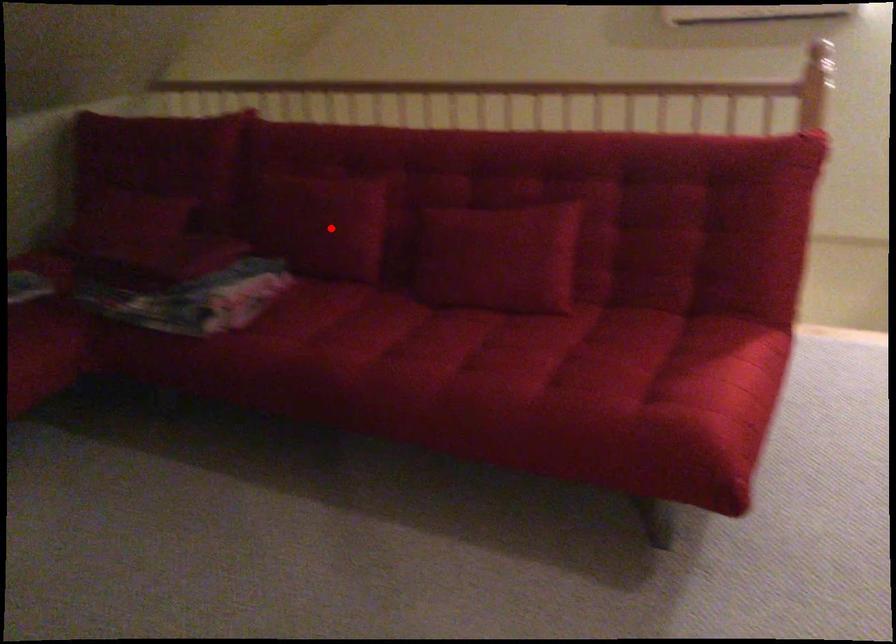
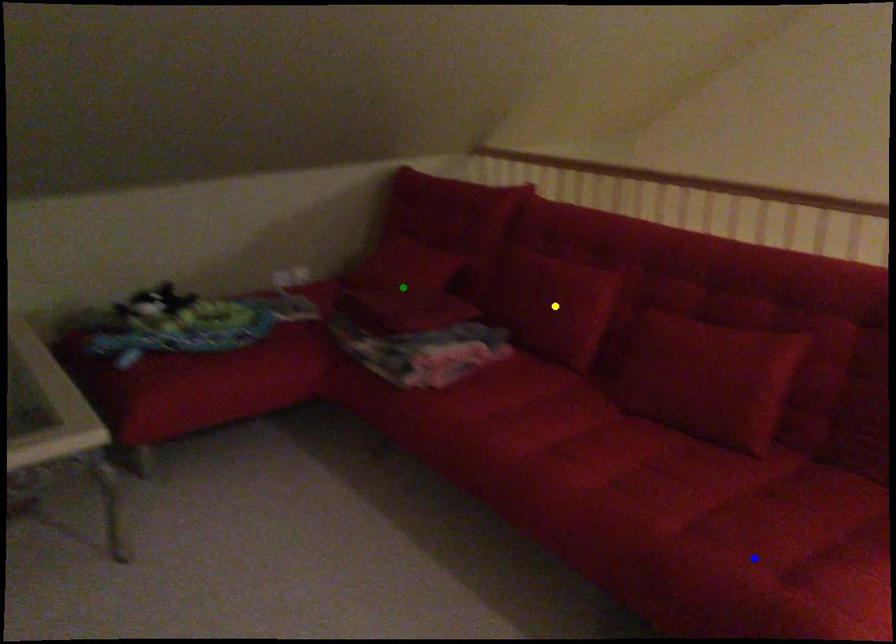
Question: I am providing you with two images of the same scene from different viewpoints. A red point is marked on the first image. You are given multiple points on the second image. Can you choose the point in image 2 that corresponds to the point in image 1?

Choices:
 (A) green point
 (B) blue point
 (C) yellow point

Answer: (C)